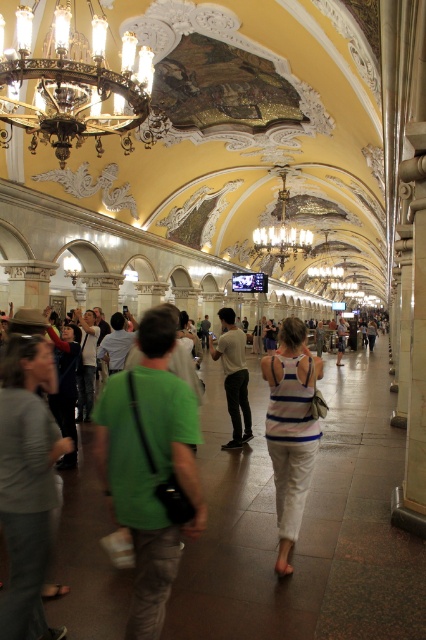
You are standing in the Moscow subway station and see the white cotton shirt at center and the gold metallic chandelier at center. Which object is closer to you?

The white cotton shirt at center is closer to you because it is in front of the gold metallic chandelier at center.

Based on the photo, you are a photographer standing in the Moscow subway station and see both the gray cotton shirt at center and the green cotton shirt at center. Which shirt would you need to zoom in closer to capture the details of?

The gray cotton shirt at center has a smaller size compared to the green cotton shirt at center, so you would need to zoom in closer to capture the details of the gray cotton shirt at center.